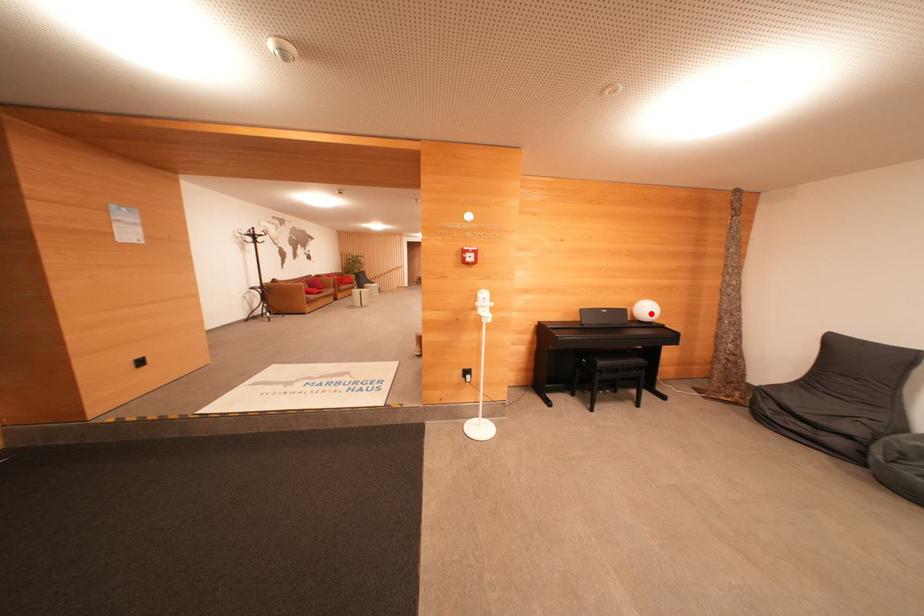
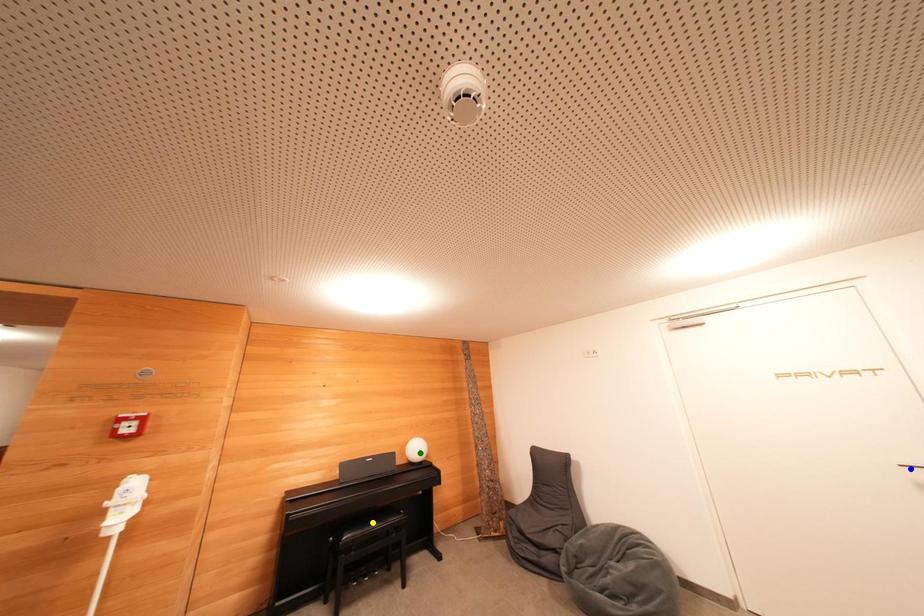
Question: I am providing you with two images of the same scene from different viewpoints. A red point is marked on the first image. You are given multiple points on the second image. Which spot in image 2 lines up with the point in image 1?

Choices:
 (A) yellow point
 (B) green point
 (C) blue point

Answer: (B)